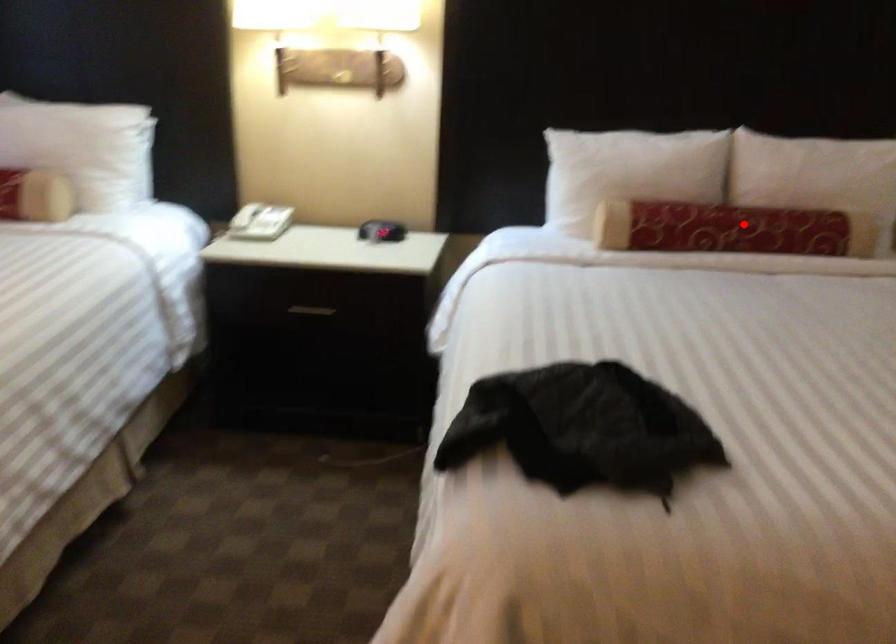
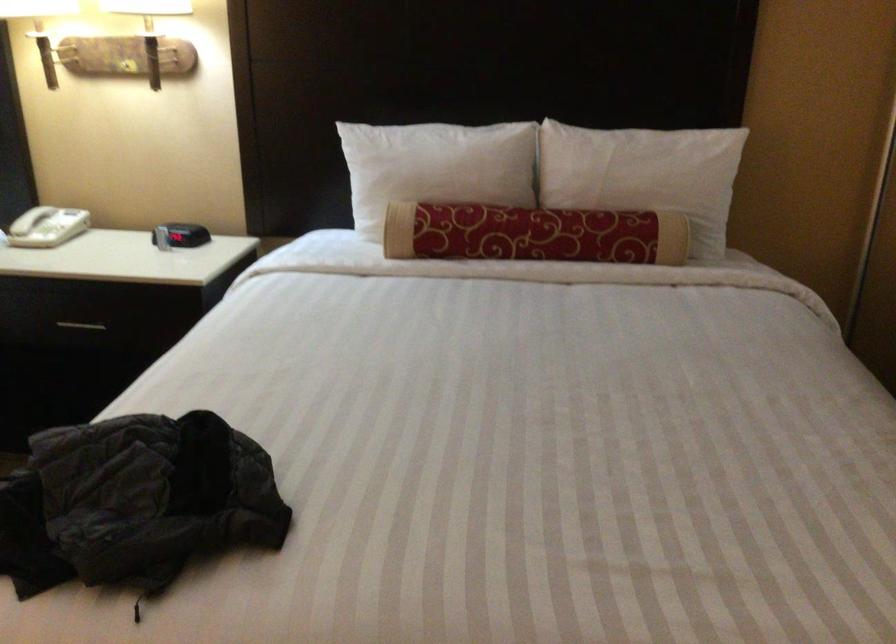
Question: I am providing you with two images of the same scene from different viewpoints. In image1, a red point is highlighted. Considering the same 3D point in image2, which of the following is correct?

Choices:
 (A) It is closer
 (B) It is farther

Answer: (A)